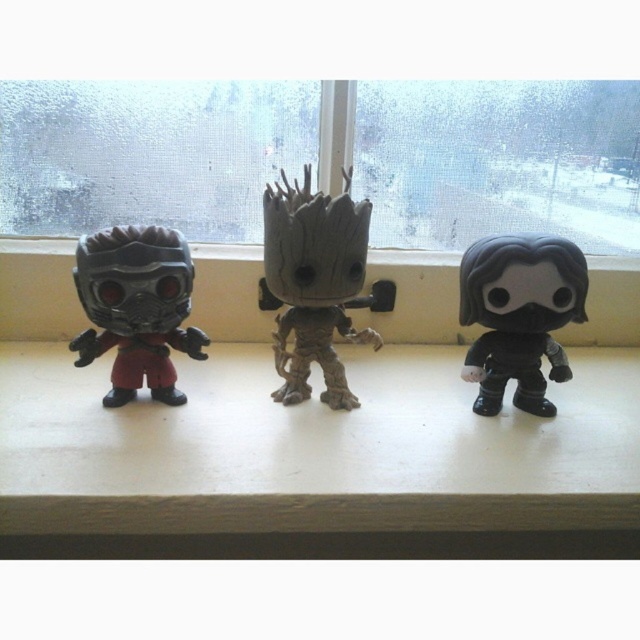
Is frosted glass window at center positioned behind gray textured tree man at center?

Yes.

Where is `frosted glass window at center`? frosted glass window at center is located at coordinates pos(499,161).

Is gray textured tree man at center bigger than matte black figure at left?

Yes, gray textured tree man at center is bigger than matte black figure at left.

From the picture: Is gray textured tree man at center to the right of matte black figure at left from the viewer's perspective?

Yes, gray textured tree man at center is to the right of matte black figure at left.

What are the coordinates of `gray textured tree man at center` in the screenshot? It's located at (314, 284).

Who is positioned more to the right, frosted glass window at center or matte black figure at left?

frosted glass window at center

Is point (404, 97) positioned after point (168, 300)?

That is True.

Where is `frosted glass window at center`? The width and height of the screenshot is (640, 640). frosted glass window at center is located at coordinates (499, 161).